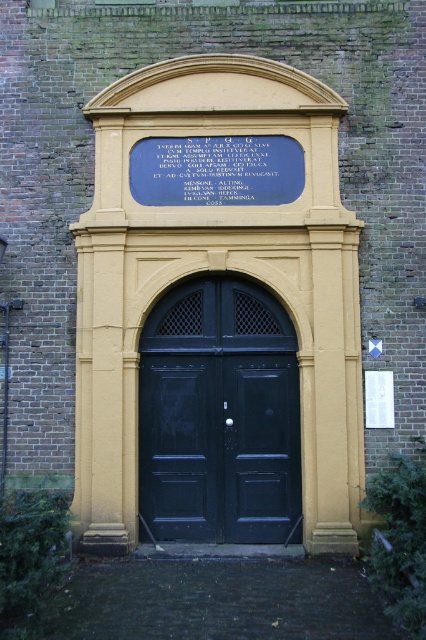
You are standing at the entrance of the building and want to open the black wooden door at center. Where exactly should you approach to find the door handle?

The black wooden door at center is located at point 0.650 on the x axis and 0.514 on the y axis, so you should approach the door at those coordinates to find the handle.

You are an architect designing a new building and want to replicate the style of this archway. You need to know the relative sizes of the black wooden door at center and the blue stone plaque at upper center to maintain proportion. Which object is larger?

The black wooden door at center is bigger than the blue stone plaque at upper center, so the door should be made larger than the plaque to maintain the correct proportions.

You are standing in front of the building and want to touch both the black wooden door at center and the blue stone plaque at upper center. Which one can you reach without moving your position?

The black wooden door at center is 6.75 feet away from the blue stone plaque at upper center. Since the door is closer to you, you can reach the black wooden door at center without moving, but you cannot reach the plaque as it is farther away.